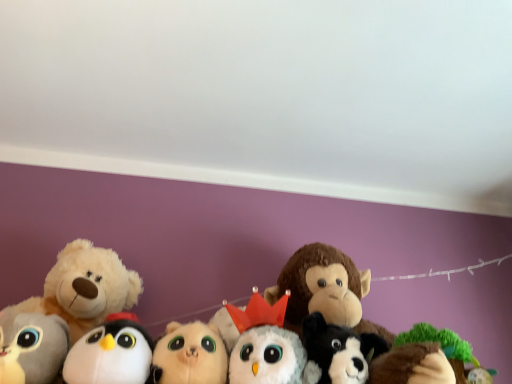
Question: From a real-world perspective, does white plush penguin at lower left, the 5th toy positioned from the right, sit lower than green plush tree at lower right, acting as the 1th toy starting from the right?

Choices:
 (A) yes
 (B) no

Answer: (A)

Question: Would you say green plush tree at lower right, arranged as the seventh toy when viewed from the left, is part of white plush penguin at lower left, the 5th toy positioned from the right,'s contents?

Choices:
 (A) no
 (B) yes

Answer: (A)

Question: Is white plush penguin at lower left, placed as the 3th toy when sorted from left to right, not close to green plush tree at lower right, arranged as the seventh toy when viewed from the left?

Choices:
 (A) yes
 (B) no

Answer: (B)

Question: Is white plush penguin at lower left, placed as the 3th toy when sorted from left to right, taller than green plush tree at lower right, arranged as the seventh toy when viewed from the left?

Choices:
 (A) yes
 (B) no

Answer: (A)

Question: From the image's perspective, is white plush penguin at lower left, placed as the 3th toy when sorted from left to right, under green plush tree at lower right, arranged as the seventh toy when viewed from the left?

Choices:
 (A) yes
 (B) no

Answer: (B)

Question: From the image's perspective, is white plush dog at center, which is the second toy from right to left, above or below gray plush toy at lower left, the first toy when ordered from left to right?

Choices:
 (A) below
 (B) above

Answer: (A)

Question: Is point (307, 337) closer or farther from the camera than point (16, 344)?

Choices:
 (A) farther
 (B) closer

Answer: (A)

Question: Considering the positions of white plush dog at center, which is the second toy from right to left, and gray plush toy at lower left, the first toy when ordered from left to right, in the image, is white plush dog at center, which is the second toy from right to left, taller or shorter than gray plush toy at lower left, the first toy when ordered from left to right,?

Choices:
 (A) short
 (B) tall

Answer: (B)

Question: From a real-world perspective, is white plush dog at center, the 6th toy from the left, positioned above or below gray plush toy at lower left, the first toy when ordered from left to right?

Choices:
 (A) below
 (B) above

Answer: (B)

Question: Considering the positions of white plush owl at center, the 5th toy when ordered from left to right, and green plush tree at lower right, acting as the 1th toy starting from the right, in the image, is white plush owl at center, the 5th toy when ordered from left to right, bigger or smaller than green plush tree at lower right, acting as the 1th toy starting from the right,?

Choices:
 (A) small
 (B) big

Answer: (B)

Question: Is white plush owl at center, which is the third toy in right-to-left order, inside or outside of green plush tree at lower right, acting as the 1th toy starting from the right?

Choices:
 (A) outside
 (B) inside

Answer: (A)

Question: Is point (241, 322) closer or farther from the camera than point (410, 336)?

Choices:
 (A) farther
 (B) closer

Answer: (A)

Question: From the image's perspective, relative to green plush tree at lower right, acting as the 1th toy starting from the right, is white plush owl at center, which is the third toy in right-to-left order, above or below?

Choices:
 (A) above
 (B) below

Answer: (A)

Question: From the image's perspective, is green plush tree at lower right, arranged as the seventh toy when viewed from the left, above or below white plush owl at center, which is the third toy in right-to-left order?

Choices:
 (A) above
 (B) below

Answer: (B)

Question: Would you say green plush tree at lower right, arranged as the seventh toy when viewed from the left, is to the left or to the right of white plush owl at center, the 5th toy when ordered from left to right, in the picture?

Choices:
 (A) left
 (B) right

Answer: (B)